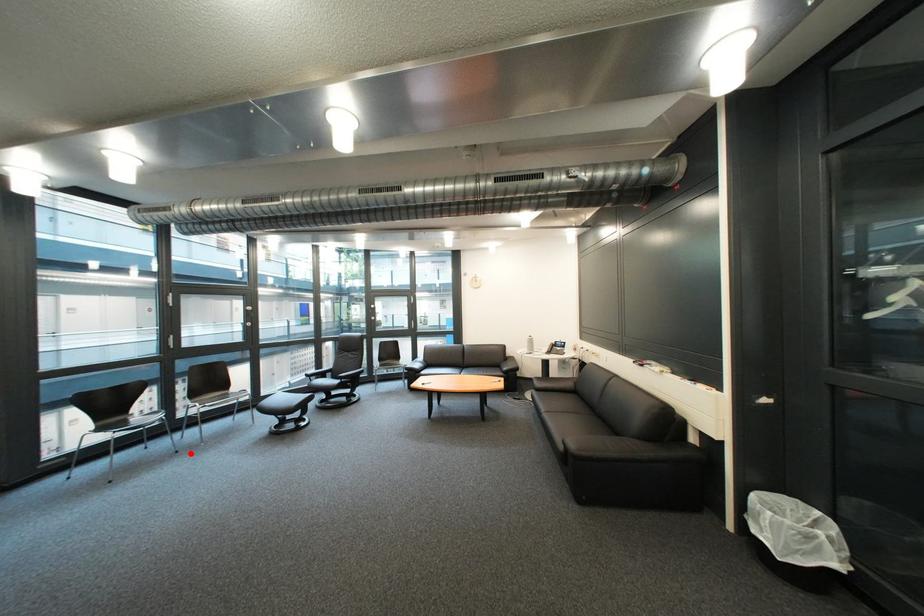
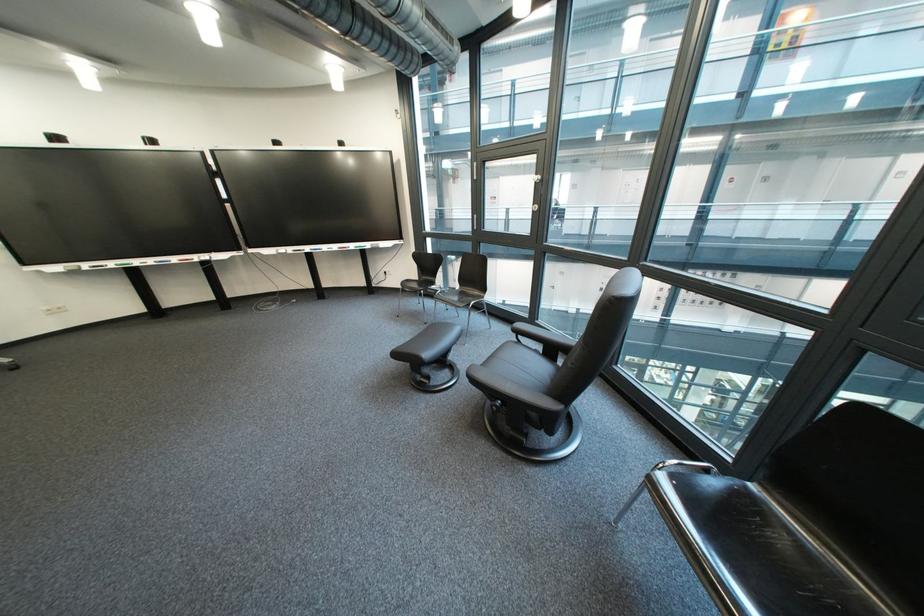
Question: I am providing you with two images of the same scene from different viewpoints. In image1, a red point is highlighted. Considering the same 3D point in image2, which of the following is correct?

Choices:
 (A) It is closer
 (B) It is farther

Answer: (B)